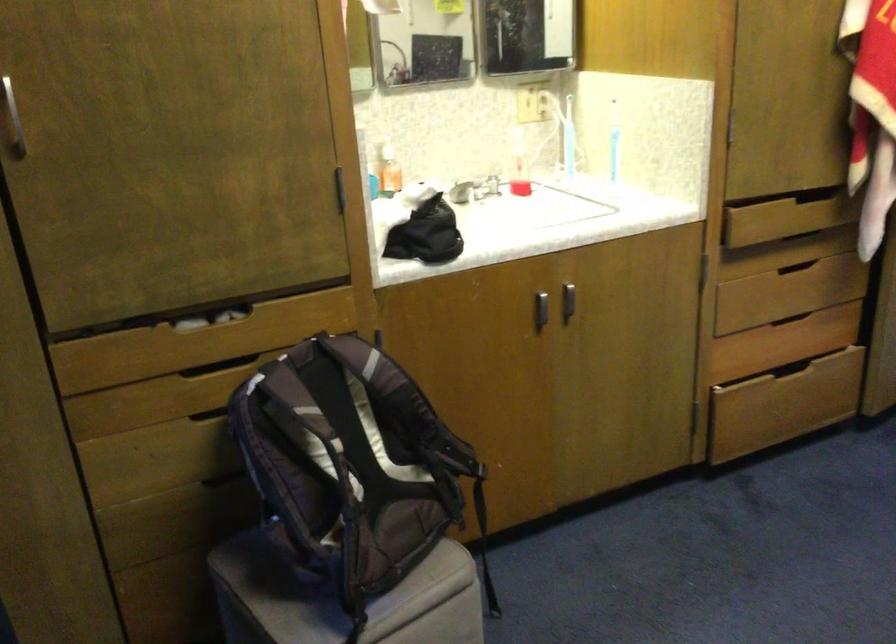
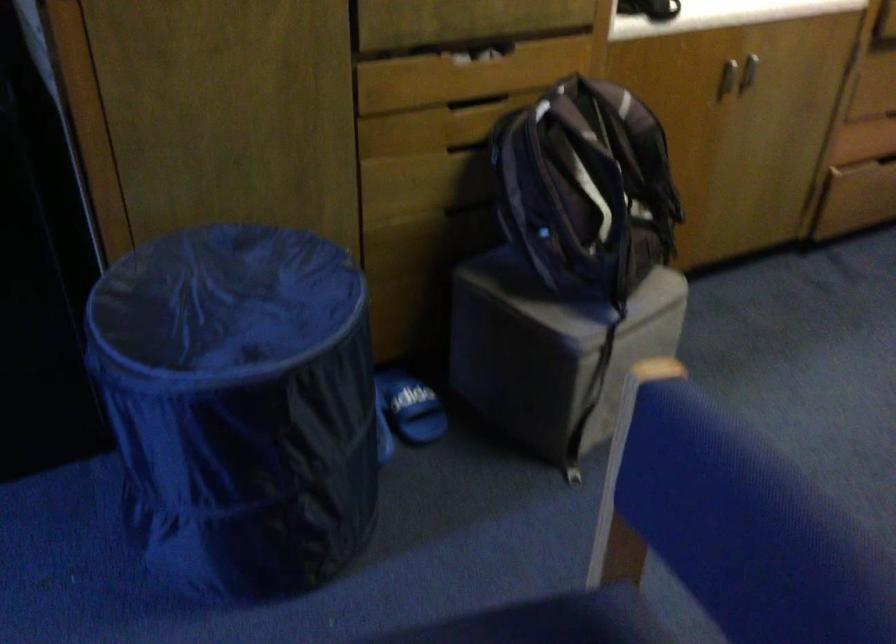
Locate, in the second image, the point that corresponds to (538,319) in the first image.

(728, 79)